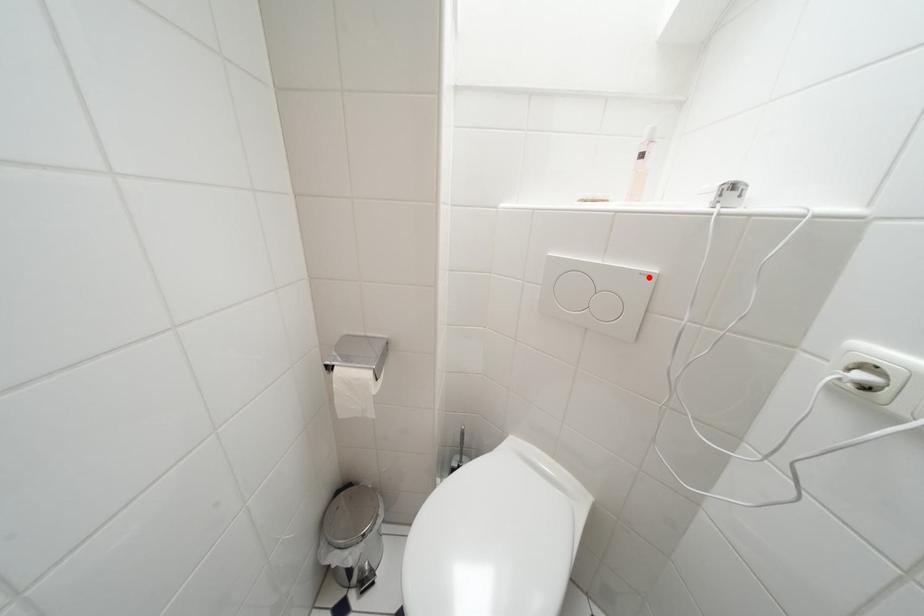
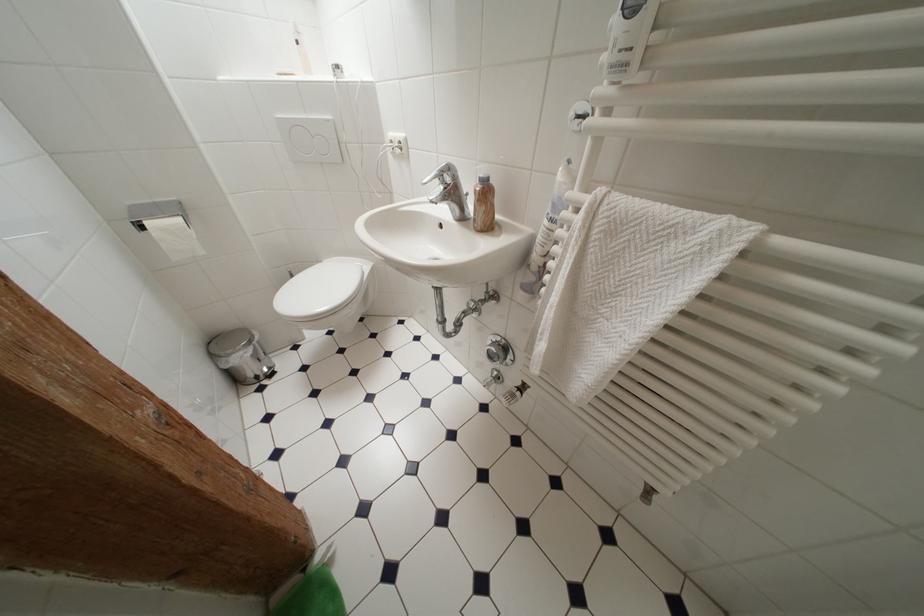
Find the pixel in the second image that matches the highlighted location in the first image.

(333, 124)